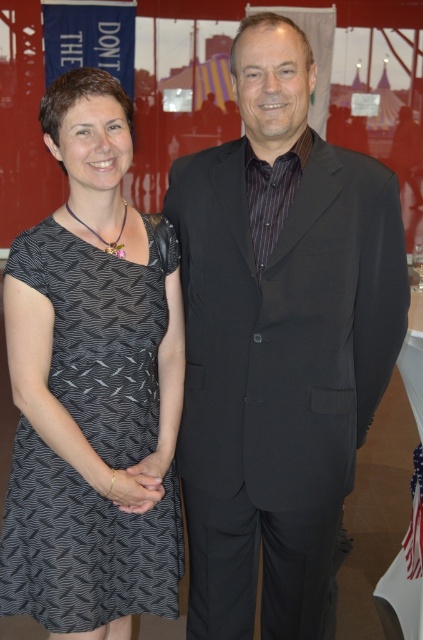
Is point (230, 324) farther from camera compared to point (49, 573)?

Yes, it is.

Does black matte suit at center have a greater width compared to black printed fabric dress at left?

Correct, the width of black matte suit at center exceeds that of black printed fabric dress at left.

Does point (308, 394) come in front of point (126, 397)?

Yes, point (308, 394) is in front of point (126, 397).

Locate an element on the screen. black matte suit at center is located at coordinates (279, 342).